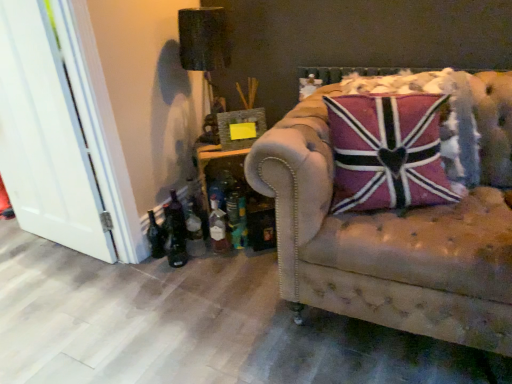
Image resolution: width=512 pixels, height=384 pixels. What are the coordinates of `free spot to the right of dark glass bottle at lower left, which is the 1th bottle from left to right` in the screenshot? It's located at (198, 260).